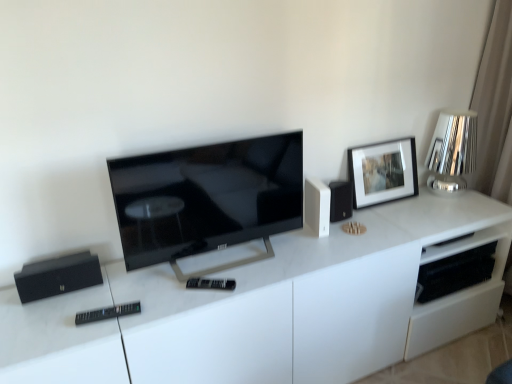
In order to click on vacant space in front of black plastic remote at center, the 1th remote when ordered from right to left in this screenshot , I will do `click(199, 309)`.